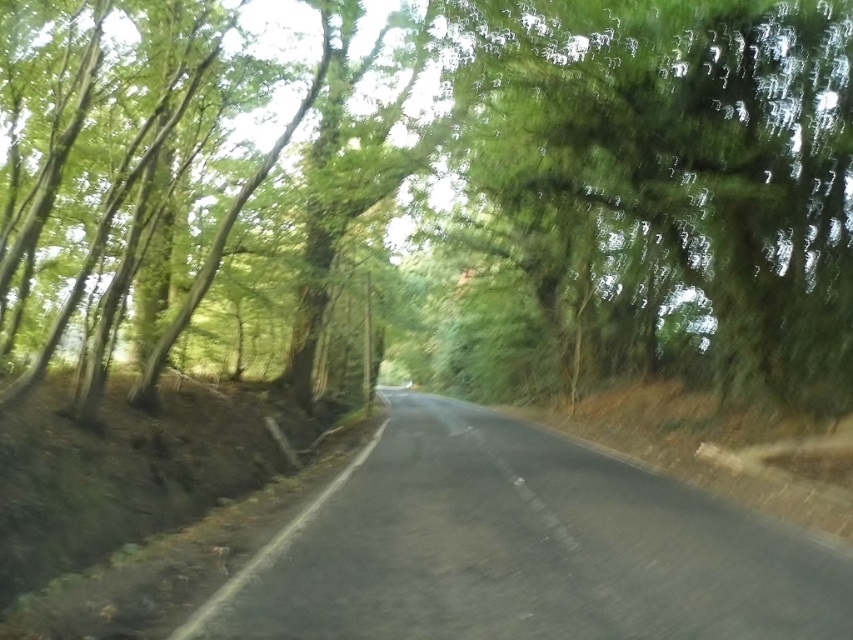
You are driving a car that is 2 meters wide. You come across a narrow section of the road. Can you safely pass through the narrow section if the green leafy tree at upper center is wider than the black asphalt road at center?

The green leafy tree at upper center is wider than the black asphalt road at center, so the road might be too narrow for the car to pass safely. The car is 2 meters wide, and if the road is narrower than that, it would be risky. However, the description only states the tree is wider than the road, not the road width itself. Without knowing the exact width of the road, it is uncertain if the car can pass safely.

You are a hiker walking along the curving road in the forest. You notice two green leafy trees ahead. One is labeled as the green leafy tree at center and the other as the green leafy tree at upper center. Which tree would appear closer to you as you walk along the road?

The green leafy tree at center is much taller than the green leafy tree at upper center. Since taller objects can appear closer even if they are further away, the green leafy tree at center would likely appear closer to you as you walk along the road.

You are a hiker standing at the start of the black asphalt road at center and want to reach a cabin located beyond the green leafy tree at center. Considering the height difference between them, which object might block your direct line of sight to the cabin?

The green leafy tree at center has a greater height compared to the black asphalt road at center, so it might block your direct line of sight to the cabin.